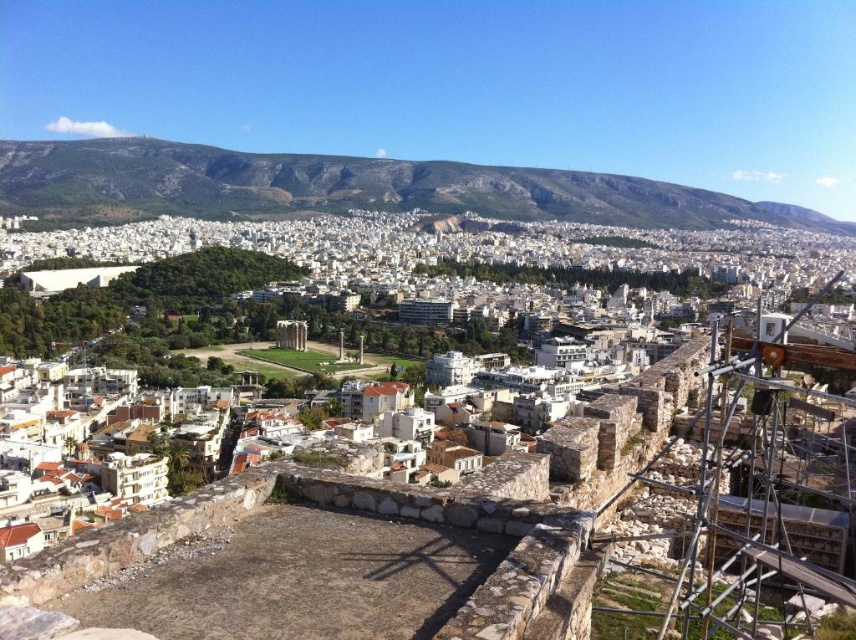
Which is more to the left, brown stone wall at center or rocky brown mountain at upper center?

Positioned to the left is brown stone wall at center.

Measure the distance between point (749, 580) and camera.

A distance of 65.82 meters exists between point (749, 580) and camera.

You are a GUI agent. You are given a task and a screenshot of the screen. Output one action in this format:
    pyautogui.click(x=<x>, y=<y>)
    Task: Click on the brown stone wall at center
    The image size is (856, 640).
    Given the screenshot: What is the action you would take?
    pyautogui.click(x=449, y=506)